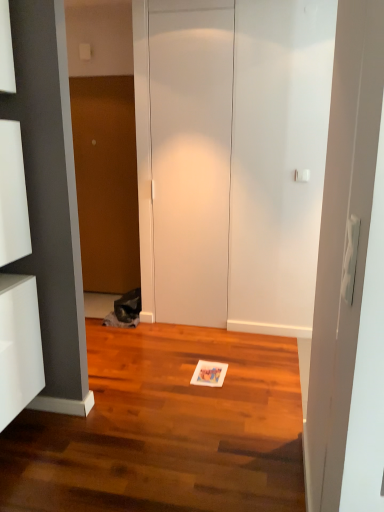
Question: Is wooden door at center, placed as the first door when sorted from back to front, at the right side of white matte door at center, acting as the 1th door starting from the front?

Choices:
 (A) no
 (B) yes

Answer: (A)

Question: Is wooden door at center, placed as the first door when sorted from back to front, facing away from white matte door at center, acting as the 1th door starting from the front?

Choices:
 (A) no
 (B) yes

Answer: (A)

Question: From the image's perspective, is wooden door at center, the second door when ordered from right to left, on top of white matte door at center, the 2th door when ordered from back to front?

Choices:
 (A) no
 (B) yes

Answer: (B)

Question: From a real-world perspective, is wooden door at center, acting as the 2th door starting from the front, on white matte door at center, which appears as the 2th door when viewed from the left?

Choices:
 (A) no
 (B) yes

Answer: (A)

Question: From the image's perspective, is wooden door at center, placed as the first door when sorted from back to front, beneath white matte door at center, acting as the 1th door starting from the front?

Choices:
 (A) yes
 (B) no

Answer: (B)

Question: Does wooden door at center, acting as the first door starting from the left, come behind white matte door at center, acting as the 1th door starting from the front?

Choices:
 (A) no
 (B) yes

Answer: (B)

Question: Can you confirm if white matte door at center, which appears as the 2th door when viewed from the left, is wider than white glossy cabinet at left?

Choices:
 (A) no
 (B) yes

Answer: (A)

Question: Is white matte door at center, the 1th door when ordered from right to left, thinner than white glossy cabinet at left?

Choices:
 (A) yes
 (B) no

Answer: (A)

Question: Is white matte door at center, the 2th door when ordered from back to front, positioned with its back to white glossy cabinet at left?

Choices:
 (A) yes
 (B) no

Answer: (B)

Question: Is white matte door at center, the 2th door when ordered from back to front, outside white glossy cabinet at left?

Choices:
 (A) no
 (B) yes

Answer: (B)

Question: Considering the relative sizes of white matte door at center, acting as the 1th door starting from the front, and white glossy cabinet at left in the image provided, is white matte door at center, acting as the 1th door starting from the front, smaller than white glossy cabinet at left?

Choices:
 (A) no
 (B) yes

Answer: (A)

Question: Is white matte door at center, which appears as the 2th door when viewed from the left, at the left side of white glossy cabinet at left?

Choices:
 (A) yes
 (B) no

Answer: (B)

Question: Is white glossy cabinet at left next to white matte door at center, the 2th door when ordered from back to front?

Choices:
 (A) yes
 (B) no

Answer: (B)